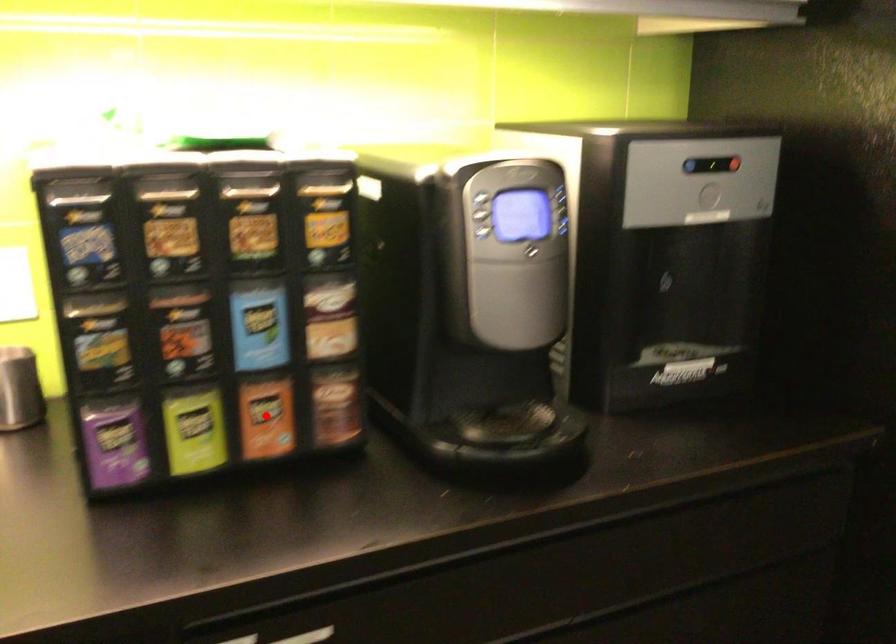
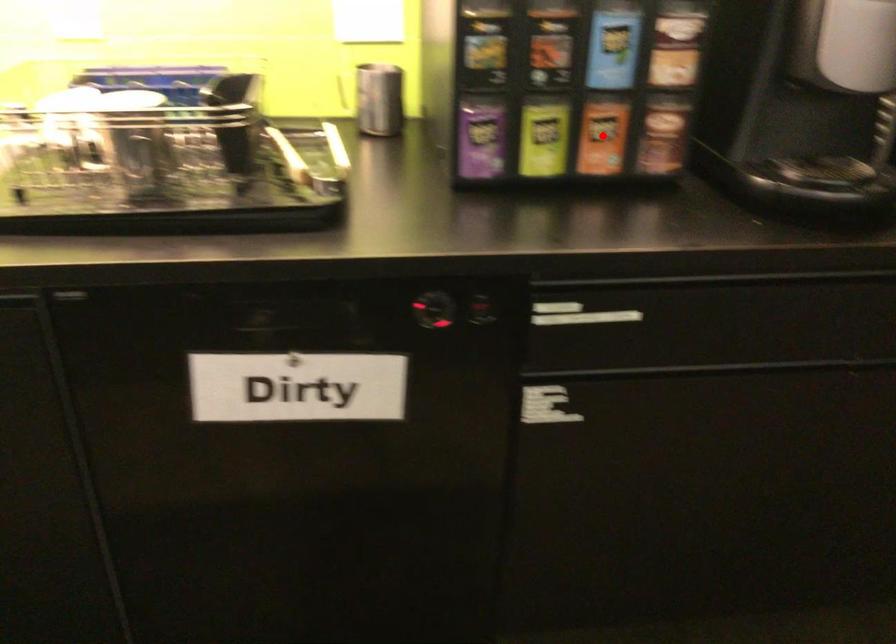
From the picture: I am providing you with two images of the same scene from different viewpoints. A red point is marked on the first image and another point is marked on the second image. Are the points marked in image1 and image2 representing the same 3D position?

Yes